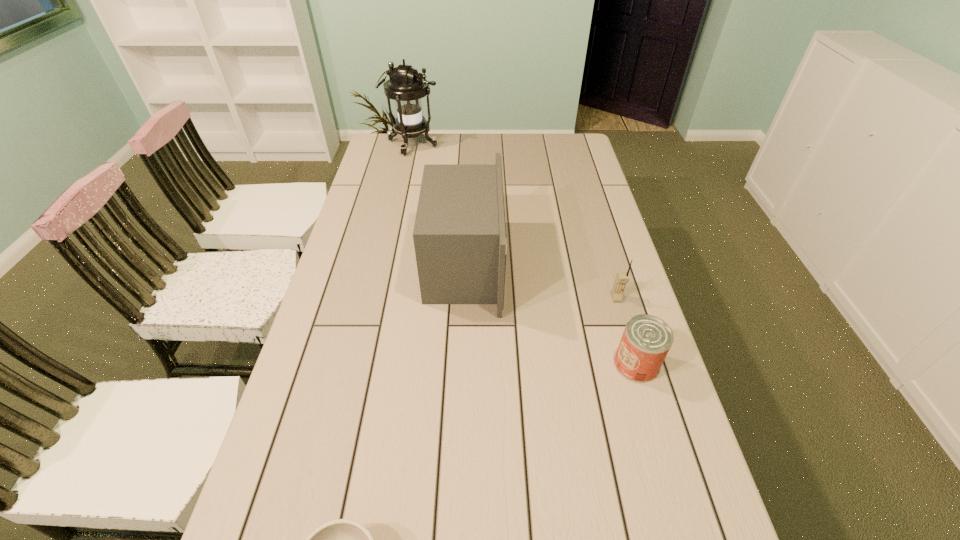
Locate an element on the screen. The image size is (960, 540). free spot between the farthest object and the cellular telephone is located at coordinates (515, 221).

In order to click on free point between the cellular telephone and the farthest object in this screenshot , I will do `click(515, 221)`.

At what (x,y) coordinates should I click in order to perform the action: click on free area in between the third object from right to left and the cellular telephone. Please return your answer as a coordinate pair (x, y). Looking at the image, I should click on (540, 282).

This screenshot has width=960, height=540. In order to click on free space that is in between the cellular telephone and the fourth shortest object in this screenshot , I will do `click(540, 282)`.

Locate an element on the screen. The height and width of the screenshot is (540, 960). vacant point located between the third object from left to right and the cellular telephone is located at coordinates (x=540, y=282).

Select which object appears as the fourth closest to the shortest object. Please provide its 2D coordinates. Your answer should be formatted as a tuple, i.e. [(x, y)], where the tuple contains the x and y coordinates of a point satisfying the conditions above.

[(406, 86)]

Where is `object that stands as the third closest to the fourth farthest object`? object that stands as the third closest to the fourth farthest object is located at coordinates (x=343, y=539).

The image size is (960, 540). What are the coordinates of `free point that satisfies the following two spatial constraints: 1. on the front side of the farthest object; 2. on the right side of the can` in the screenshot? It's located at (365, 364).